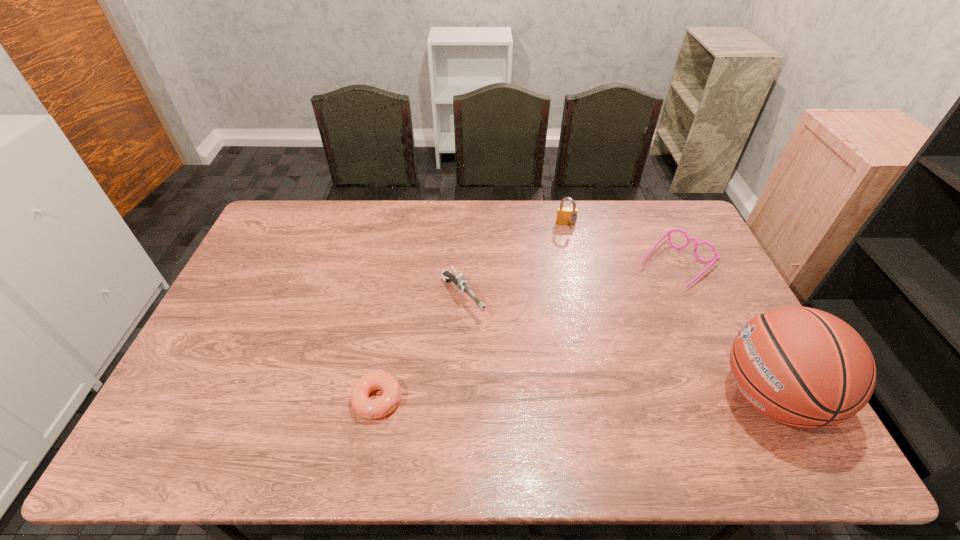
Where is `vacant point located between the third tallest object and the second shortest object`? Image resolution: width=960 pixels, height=540 pixels. vacant point located between the third tallest object and the second shortest object is located at coordinates (569, 282).

You are a GUI agent. You are given a task and a screenshot of the screen. Output one action in this format:
    pyautogui.click(x=<x>, y=<y>)
    Task: Click on the vacant area between the basketball and the doughnut
    
    Given the screenshot: What is the action you would take?
    pyautogui.click(x=574, y=398)

Image resolution: width=960 pixels, height=540 pixels. Identify the location of free spot between the basketball and the second shortest object. (724, 331).

Find the location of a particular element. The image size is (960, 540). empty space between the padlock and the shortest object is located at coordinates (472, 313).

What are the coordinates of `vacant space that's between the leftmost object and the spectacles` in the screenshot? It's located at (527, 332).

Identify the location of vacant space that's between the spectacles and the leftmost object. (527, 332).

Locate which object is the third closest to the padlock. Please provide its 2D coordinates. Your answer should be formatted as a tuple, i.e. [(x, y)], where the tuple contains the x and y coordinates of a point satisfying the conditions above.

[(803, 367)]

Identify which object is the fourth nearest to the fourth shortest object. Please provide its 2D coordinates. Your answer should be formatted as a tuple, i.e. [(x, y)], where the tuple contains the x and y coordinates of a point satisfying the conditions above.

[(368, 408)]

Identify the location of vacant space that satisfies the following two spatial constraints: 1. on the back side of the second shortest object; 2. on the right side of the doughnut. The image size is (960, 540). (402, 265).

I want to click on free space that satisfies the following two spatial constraints: 1. on the front side of the second shortest object; 2. on the left side of the padlock, so click(x=575, y=265).